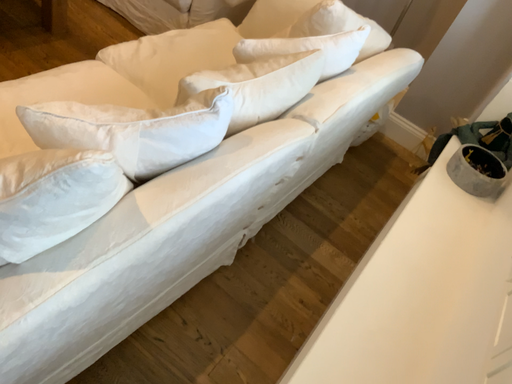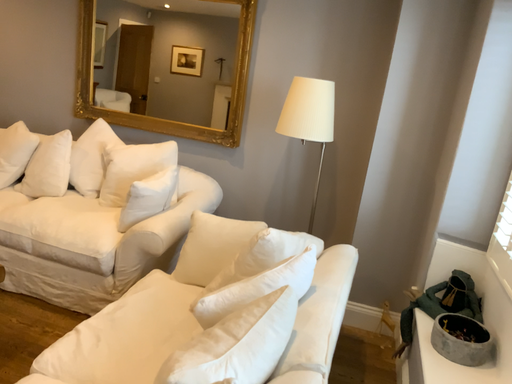
Question: Which way did the camera rotate in the video?

Choices:
 (A) rotated right
 (B) rotated left

Answer: (A)